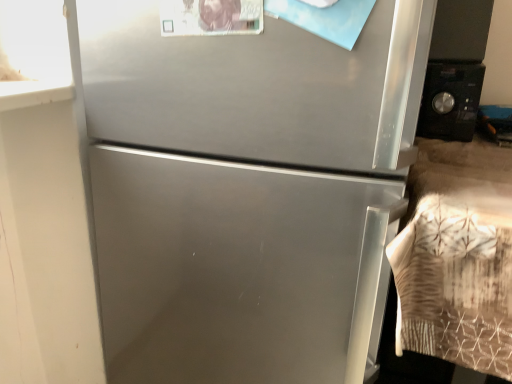
Question: Is black matte microwave at right far from satin silver refrigerator at center?

Choices:
 (A) yes
 (B) no

Answer: (B)

Question: From a real-world perspective, is black matte microwave at right located beneath satin silver refrigerator at center?

Choices:
 (A) yes
 (B) no

Answer: (B)

Question: Can satin silver refrigerator at center be found inside black matte microwave at right?

Choices:
 (A) no
 (B) yes

Answer: (A)

Question: Can you confirm if black matte microwave at right is taller than satin silver refrigerator at center?

Choices:
 (A) yes
 (B) no

Answer: (B)

Question: From the image's perspective, is black matte microwave at right beneath satin silver refrigerator at center?

Choices:
 (A) no
 (B) yes

Answer: (A)

Question: Is black matte microwave at right facing towards satin silver refrigerator at center?

Choices:
 (A) yes
 (B) no

Answer: (B)

Question: From a real-world perspective, is satin silver refrigerator at center on black matte microwave at right?

Choices:
 (A) no
 (B) yes

Answer: (A)

Question: Is satin silver refrigerator at center far away from black matte microwave at right?

Choices:
 (A) yes
 (B) no

Answer: (B)

Question: From a real-world perspective, is satin silver refrigerator at center beneath black matte microwave at right?

Choices:
 (A) yes
 (B) no

Answer: (A)

Question: Is satin silver refrigerator at center wider than black matte microwave at right?

Choices:
 (A) yes
 (B) no

Answer: (A)

Question: Is black matte microwave at right completely or partially inside satin silver refrigerator at center?

Choices:
 (A) yes
 (B) no

Answer: (B)

Question: Does satin silver refrigerator at center have a smaller size compared to black matte microwave at right?

Choices:
 (A) yes
 (B) no

Answer: (B)

Question: From a real-world perspective, relative to black matte microwave at right, is satin silver refrigerator at center vertically above or below?

Choices:
 (A) below
 (B) above

Answer: (A)